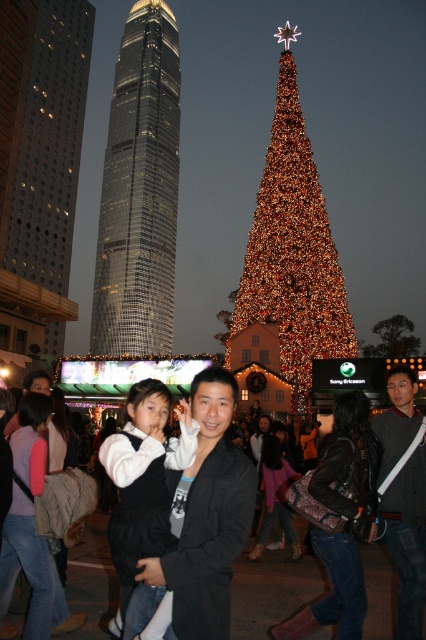
Can you confirm if glassy skyscraper at center is positioned to the right of illuminated gold christmas tree at center?

In fact, glassy skyscraper at center is to the left of illuminated gold christmas tree at center.

Between point (126, 76) and point (325, 268), which one is positioned in front?

Point (325, 268) is in front.

The height and width of the screenshot is (640, 426). Describe the element at coordinates (140, 189) in the screenshot. I see `glassy skyscraper at center` at that location.

This screenshot has width=426, height=640. I want to click on glassy skyscraper at center, so click(x=140, y=189).

Which is behind, point (198, 499) or point (354, 474)?

The point (354, 474) is behind.

Based on the photo, can you confirm if black matte jacket at center is positioned to the right of denim jeans at lower right?

Incorrect, black matte jacket at center is not on the right side of denim jeans at lower right.

Who is more distant from viewer, (172, 490) or (345, 548)?

The point (345, 548) is behind.

I want to click on black matte jacket at center, so click(206, 516).

Is glassy skyscraper at center further to camera compared to black matte jacket at center?

That is True.

Which is behind, point (169, 259) or point (249, 467)?

Positioned behind is point (169, 259).

At what (x,y) coordinates should I click in order to perform the action: click on glassy skyscraper at center. Please return your answer as a coordinate pair (x, y). The height and width of the screenshot is (640, 426). Looking at the image, I should click on (140, 189).